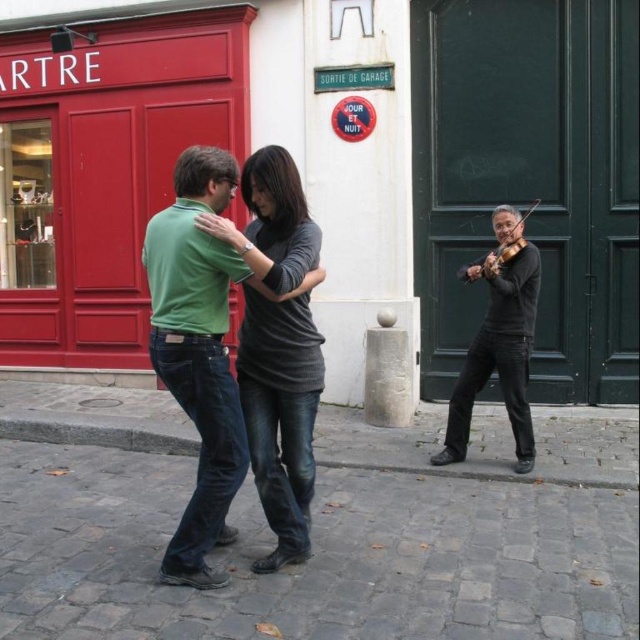
Between matte red door at left and green matte shirt at center, which one appears on the left side from the viewer's perspective?

matte red door at left is more to the left.

Measure the distance between matte red door at left and camera.

7.40 meters

Does point (42, 355) lie behind point (221, 316)?

That is True.

The height and width of the screenshot is (640, 640). Find the location of `matte red door at left`. matte red door at left is located at coordinates (102, 170).

Can you confirm if green matte shirt at center is positioned to the left of black matte violin at right?

Yes, green matte shirt at center is to the left of black matte violin at right.

Is green matte shirt at center bigger than black matte violin at right?

No, green matte shirt at center is not bigger than black matte violin at right.

What do you see at coordinates (196, 353) in the screenshot?
I see `green matte shirt at center` at bounding box center [196, 353].

Locate an element on the screen. green matte shirt at center is located at coordinates (196, 353).

Measure the distance between point (93,531) and camera.

Point (93,531) is 4.43 meters from camera.

Is gray cobblestone pavement at lower center positioned behind wooden violin at right?

No, it is in front of wooden violin at right.

Is point (209, 624) positioned after point (460, 272)?

No, it is in front of (460, 272).

Where is `gray cobblestone pavement at lower center`? The height and width of the screenshot is (640, 640). gray cobblestone pavement at lower center is located at coordinates (314, 547).